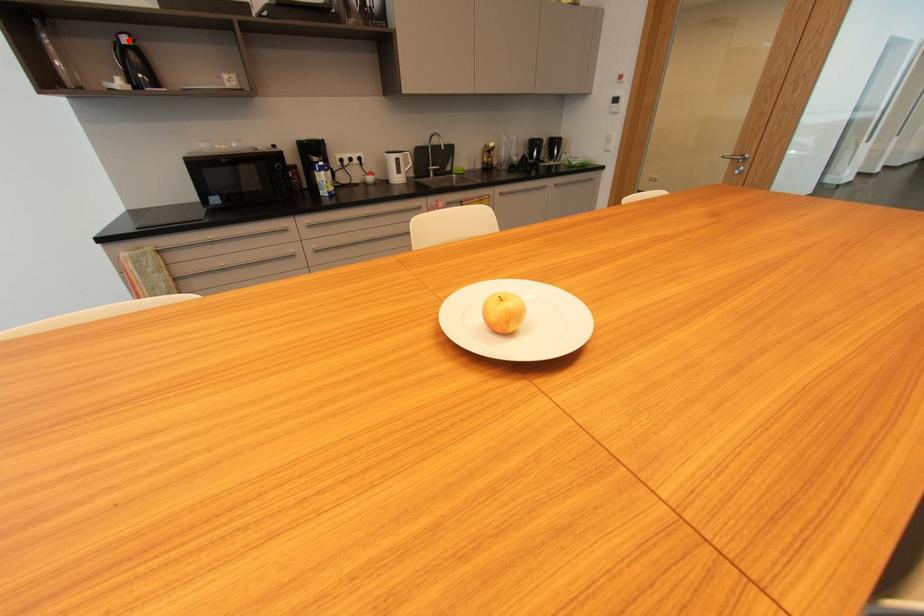
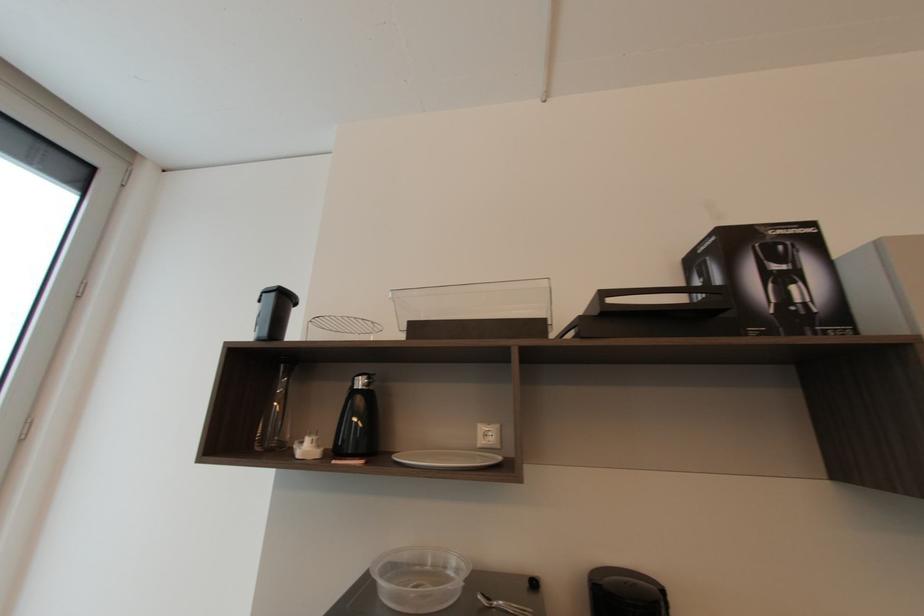
Question: I am providing you with two images of the same scene from different viewpoints. In image1, a red point is highlighted. Considering the same 3D point in image2, which of the following is correct?

Choices:
 (A) It is closer
 (B) It is farther

Answer: (A)